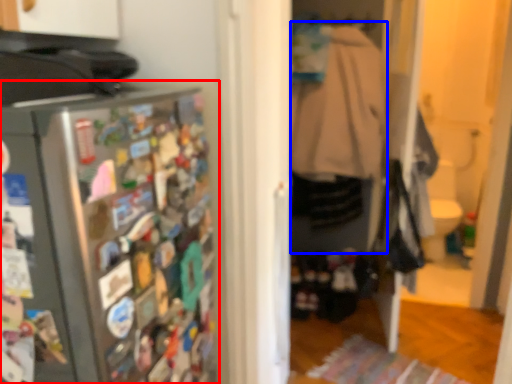
Question: Which object is further to the camera taking this photo, refrigerator (highlighted by a red box) or clothing (highlighted by a blue box)?

Choices:
 (A) refrigerator
 (B) clothing

Answer: (B)